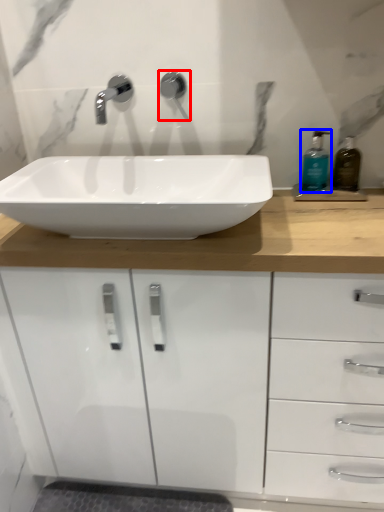
Question: Among these objects, which one is nearest to the camera, plumbing fixture (highlighted by a red box) or soap dispenser (highlighted by a blue box)?

Choices:
 (A) plumbing fixture
 (B) soap dispenser

Answer: (B)